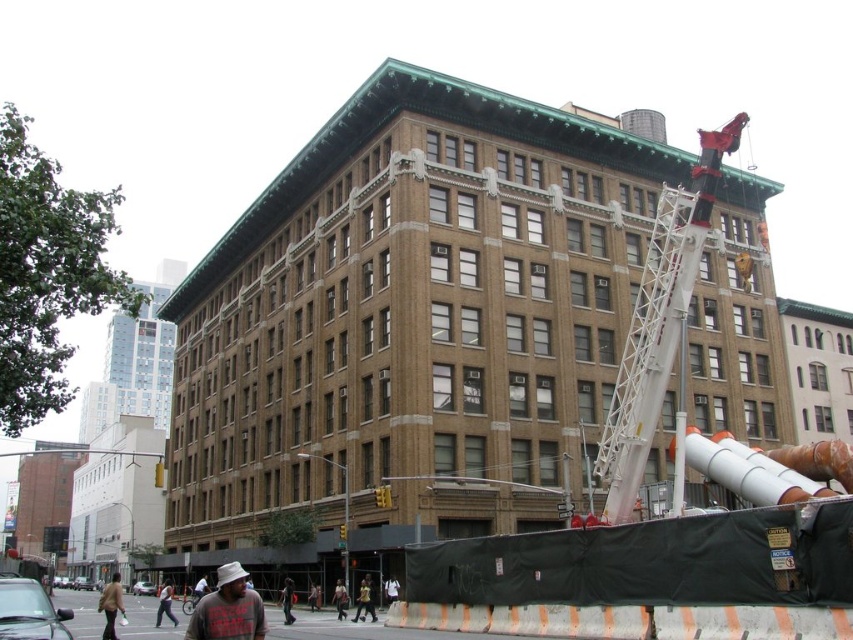
Question: Which point is farther from the camera taking this photo?

Choices:
 (A) (654, 298)
 (B) (103, 595)
 (C) (262, 604)
 (D) (606, 140)

Answer: (D)

Question: Can you confirm if brown brick building at center is wider than brown leather jacket at lower left?

Choices:
 (A) no
 (B) yes

Answer: (B)

Question: Is brown brick building at center bigger than brown leather jacket at lower left?

Choices:
 (A) yes
 (B) no

Answer: (A)

Question: Among these points, which one is nearest to the camera?

Choices:
 (A) pos(103,612)
 (B) pos(706,227)
 (C) pos(158,316)

Answer: (B)

Question: Which point is closer to the camera?

Choices:
 (A) brown leather jacket at lower left
 (B) white metallic crane at right

Answer: (B)

Question: Does white metallic crane at right have a greater width compared to brown leather jacket at lower left?

Choices:
 (A) no
 (B) yes

Answer: (A)